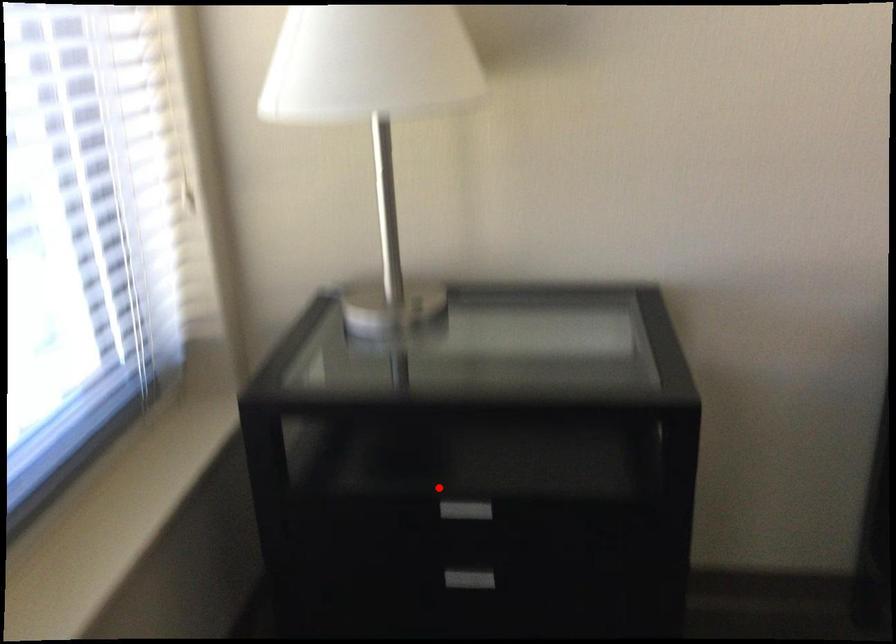
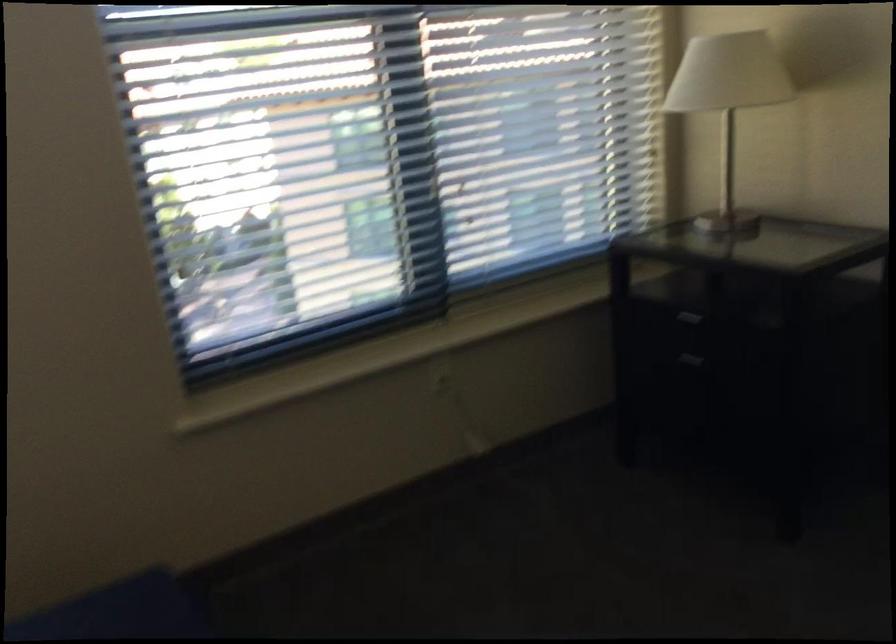
Question: I am providing you with two images of the same scene from different viewpoints. A red point is shown in image1. For the corresponding object point in image2, is it positioned nearer or farther from the camera?

Choices:
 (A) Nearer
 (B) Farther

Answer: (B)